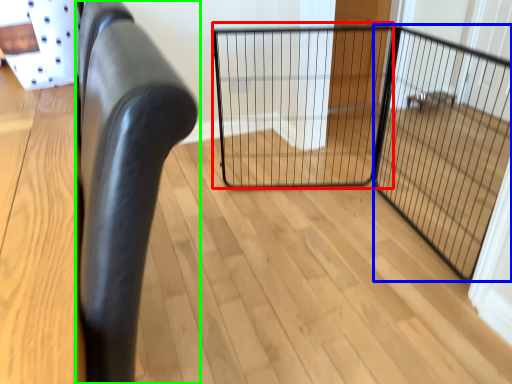
Question: Which object is the closest to the cage (highlighted by a red box)? Choose among these: screen door (highlighted by a blue box) or furniture (highlighted by a green box).

Choices:
 (A) screen door
 (B) furniture

Answer: (A)